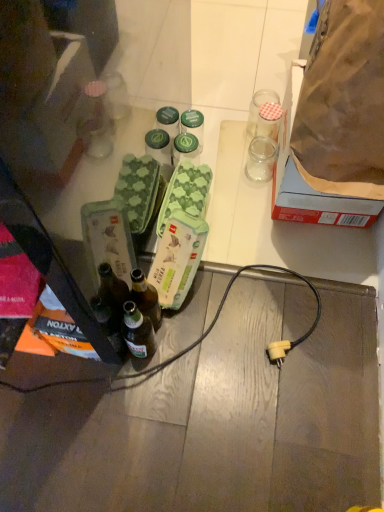
In order to click on blank space situated above green cardboard egg carton at center (from a real-world perspective) in this screenshot , I will do `click(181, 196)`.